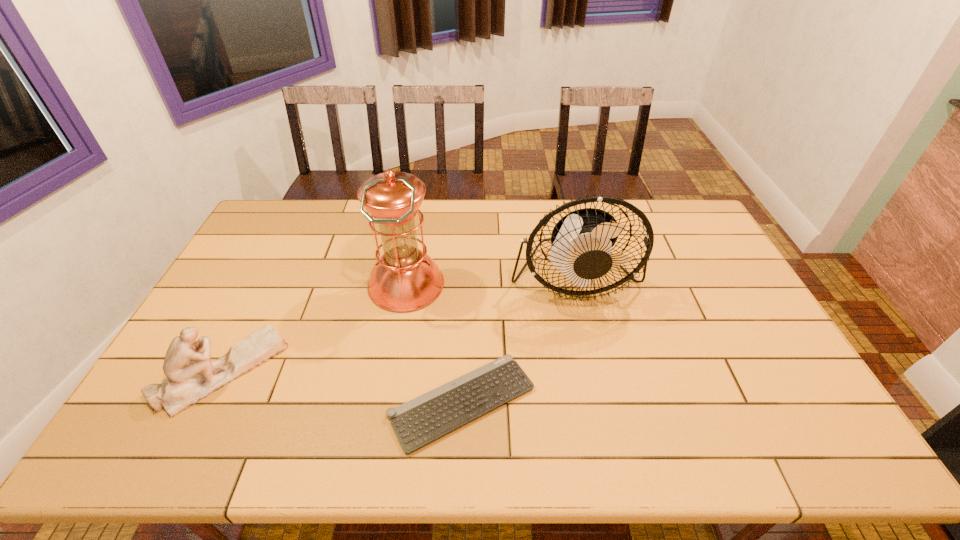
Where is `object positioned at the left edge`? The image size is (960, 540). object positioned at the left edge is located at coordinates (191, 376).

The width and height of the screenshot is (960, 540). I want to click on free space at the far edge of the desktop, so click(336, 228).

Locate an element on the screen. This screenshot has width=960, height=540. free point at the left edge is located at coordinates (222, 323).

At what (x,y) coordinates should I click in order to perform the action: click on free space at the right edge of the desktop. Please return your answer as a coordinate pair (x, y). The width and height of the screenshot is (960, 540). Looking at the image, I should click on (753, 352).

I want to click on free space at the far right corner of the desktop, so click(x=670, y=233).

The width and height of the screenshot is (960, 540). I want to click on free point between the second shortest object and the shortest object, so click(x=343, y=386).

I want to click on free space between the third tallest object and the computer keyboard, so click(343, 386).

Identify the location of empty space between the computer keyboard and the oil lamp. The image size is (960, 540). (434, 344).

Locate an element on the screen. This screenshot has height=540, width=960. free space that is in between the leftmost object and the computer keyboard is located at coordinates (343, 386).

At what (x,y) coordinates should I click in order to perform the action: click on vacant space that is in between the oil lamp and the fan. Please return your answer as a coordinate pair (x, y). The image size is (960, 540). Looking at the image, I should click on (491, 282).